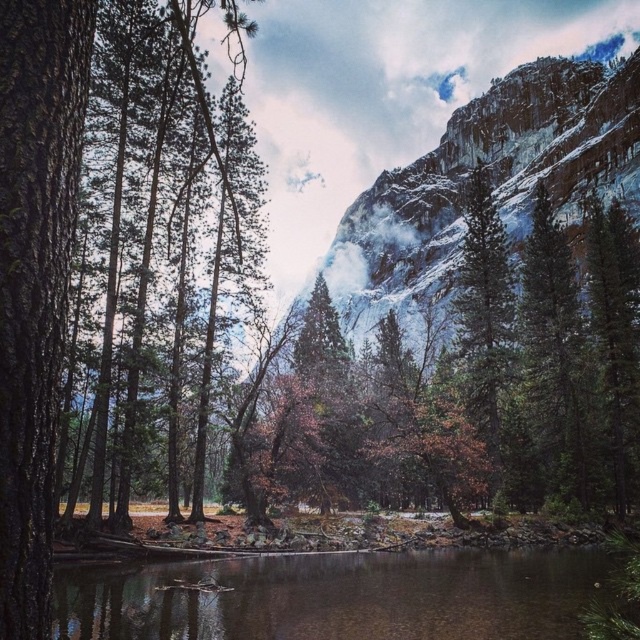
Does green matte tree at left have a greater height compared to green matte tree at right?

Yes.

Based on the photo, which is more to the left, green matte tree at left or green matte tree at right?

From the viewer's perspective, green matte tree at left appears more on the left side.

Between point (112, 124) and point (554, 368), which one is positioned in front?

Positioned in front is point (112, 124).

Where is `green matte tree at left`? Image resolution: width=640 pixels, height=640 pixels. green matte tree at left is located at coordinates (136, 196).

Is smooth bark tree at left above green matte tree at left?

No.

Which is in front, point (35, 520) or point (152, 26)?

Point (35, 520) is in front.

Is point (49, 435) positioned after point (102, 385)?

No, (49, 435) is closer to viewer.

Locate an element on the screen. The width and height of the screenshot is (640, 640). smooth bark tree at left is located at coordinates (35, 280).

Which is more to the right, clear water at center or smooth bark tree at left?

clear water at center is more to the right.

Which is above, clear water at center or smooth bark tree at left?

smooth bark tree at left

At what (x,y) coordinates should I click in order to perform the action: click on clear water at center. Please return your answer as a coordinate pair (x, y). This screenshot has height=640, width=640. Looking at the image, I should click on (339, 596).

Locate an element on the screen. This screenshot has width=640, height=640. clear water at center is located at coordinates (339, 596).